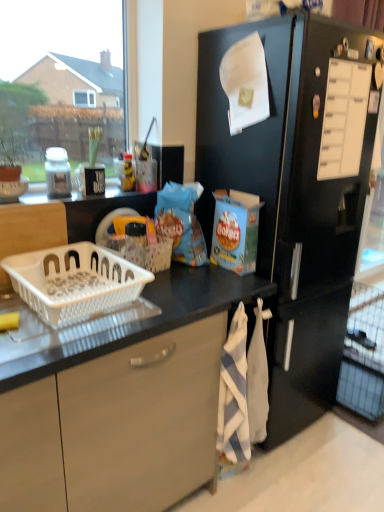
Question: Considering the positions of black matte refrigerator at right and white striped towel at lower center in the image, is black matte refrigerator at right taller or shorter than white striped towel at lower center?

Choices:
 (A) tall
 (B) short

Answer: (A)

Question: Looking at their shapes, would you say black matte refrigerator at right is wider or thinner than white striped towel at lower center?

Choices:
 (A) thin
 (B) wide

Answer: (B)

Question: Which is farther from the white matte jar at left?

Choices:
 (A) white plastic basket at lower left, which is the second basket from back to front
 (B) white plastic basket at center, which is counted as the 1th basket, starting from the back
 (C) white plastic drawer at upper right
 (D) white striped towel at lower center
 (E) black matte refrigerator at right

Answer: (C)

Question: Estimate the real-world distances between objects in this image. Which object is farther from the white plastic drawer at upper right?

Choices:
 (A) white striped towel at lower center
 (B) white plastic basket at center, acting as the 2th basket starting from the front
 (C) white plastic basket at lower left, which ranks as the first basket in front-to-back order
 (D) black matte refrigerator at right
 (E) white matte jar at left

Answer: (E)